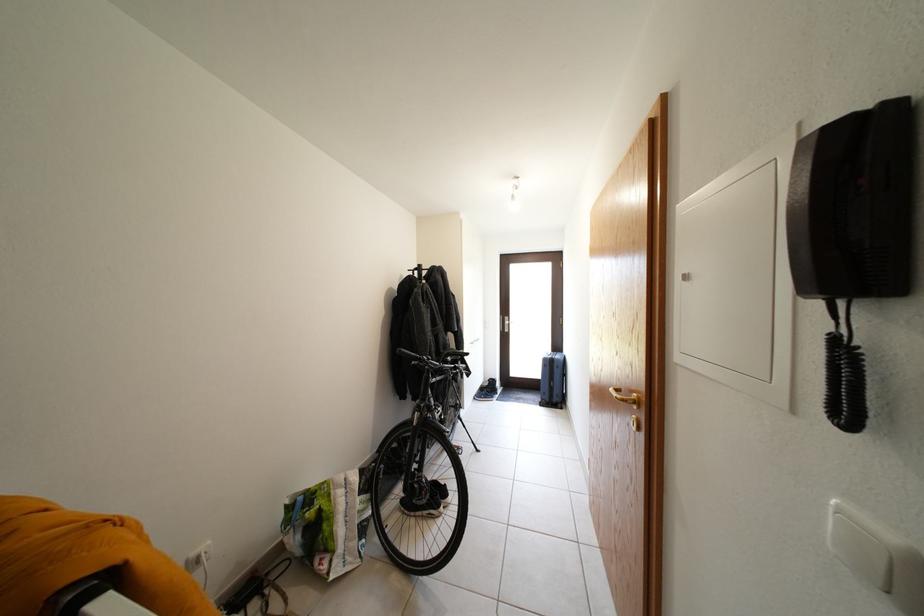
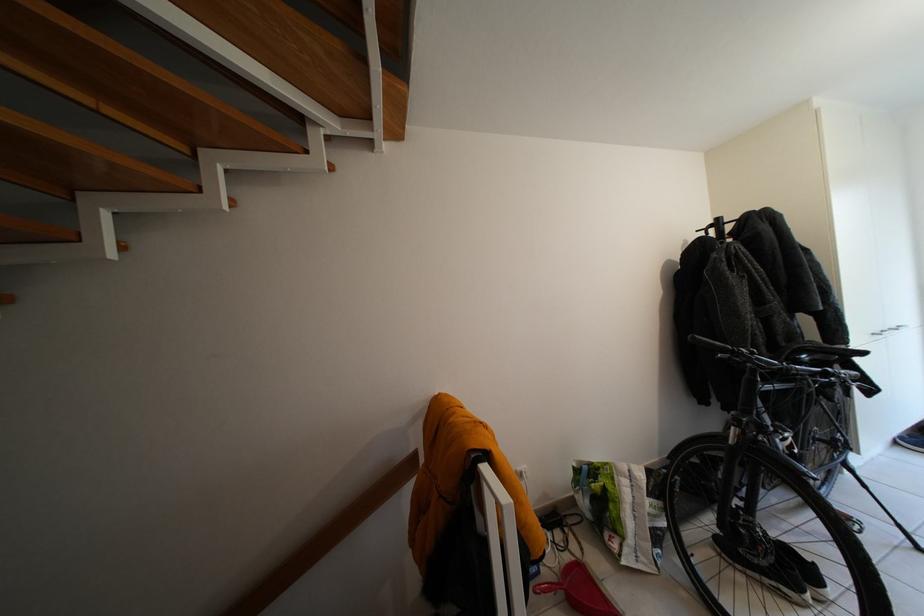
The point at [367,513] is marked in the first image. Where is the corresponding point in the second image?

(657, 515)